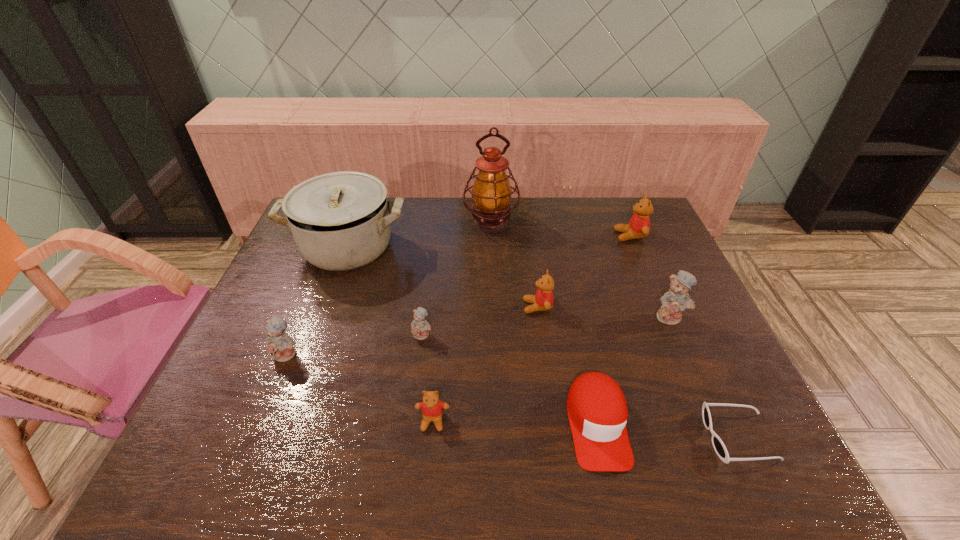
The height and width of the screenshot is (540, 960). In order to click on the leftmost blue teddy bear in this screenshot , I will do `click(278, 344)`.

Where is `the smallest blue teddy bear`? This screenshot has height=540, width=960. the smallest blue teddy bear is located at coordinates (420, 328).

Where is `the second blue teddy bear from right to left`? the second blue teddy bear from right to left is located at coordinates pyautogui.click(x=420, y=328).

Find the location of a particular element. the nearest teddy bear is located at coordinates (432, 408).

The width and height of the screenshot is (960, 540). What are the coordinates of `the leftmost red teddy bear` in the screenshot? It's located at (432, 408).

At what (x,y) coordinates should I click in order to perform the action: click on baseball cap. Please return your answer as a coordinate pair (x, y). Image resolution: width=960 pixels, height=540 pixels. Looking at the image, I should click on (597, 410).

Image resolution: width=960 pixels, height=540 pixels. Find the location of `sunglasses`. sunglasses is located at coordinates (718, 445).

At what (x,y) coordinates should I click in order to perform the action: click on the shortest object. Please return your answer as a coordinate pair (x, y). This screenshot has width=960, height=540. Looking at the image, I should click on (718, 445).

Where is `vacant area situated 0.300m on the left of the tallest object`? vacant area situated 0.300m on the left of the tallest object is located at coordinates (375, 222).

Where is `vacant space situated on the right of the saucepan`? vacant space situated on the right of the saucepan is located at coordinates (534, 248).